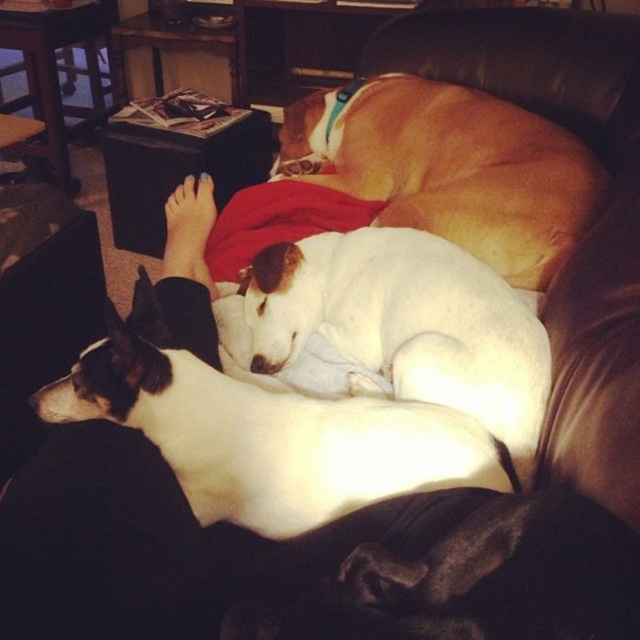
Is point (528, 454) farther from camera compared to point (410, 109)?

No, (528, 454) is in front of (410, 109).

Can you confirm if white fur dog at center is wider than white fur at center?

No.

Is point (499, 307) farther from camera compared to point (531, 125)?

No, it is not.

Image resolution: width=640 pixels, height=640 pixels. I want to click on white fur dog at center, so click(x=408, y=324).

Is point (394, 433) in front of point (346, 173)?

That is True.

This screenshot has height=640, width=640. I want to click on white smooth dog at center, so click(x=264, y=433).

Where is `white smooth dog at center`? The width and height of the screenshot is (640, 640). white smooth dog at center is located at coordinates (264, 433).

Does point (285, 492) come behind point (477, 340)?

No.

Where is `white smooth dog at center`? The height and width of the screenshot is (640, 640). white smooth dog at center is located at coordinates (264, 433).

Where is `white smooth dog at center`? Image resolution: width=640 pixels, height=640 pixels. white smooth dog at center is located at coordinates (264, 433).